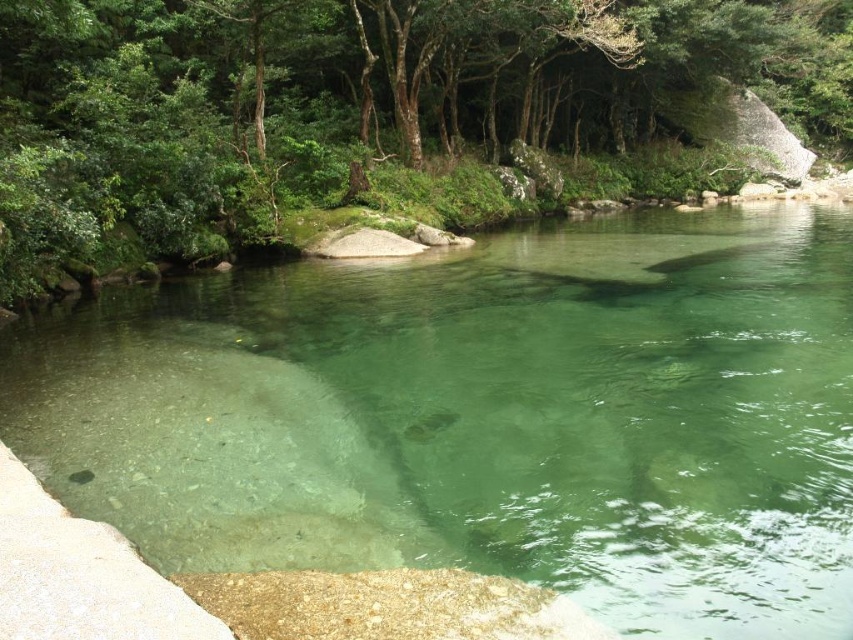
Question: Among these points, which one is farthest from the camera?

Choices:
 (A) (440, 0)
 (B) (340, 326)

Answer: (A)

Question: Does clear glassy water at center lie in front of green leafy tree at upper center?

Choices:
 (A) yes
 (B) no

Answer: (A)

Question: Does clear glassy water at center appear on the right side of green leafy tree at upper center?

Choices:
 (A) no
 (B) yes

Answer: (A)

Question: From the image, what is the correct spatial relationship of clear glassy water at center in relation to green leafy tree at upper center?

Choices:
 (A) right
 (B) left

Answer: (B)

Question: Which point is closer to the camera?

Choices:
 (A) (67, 376)
 (B) (508, 204)

Answer: (A)